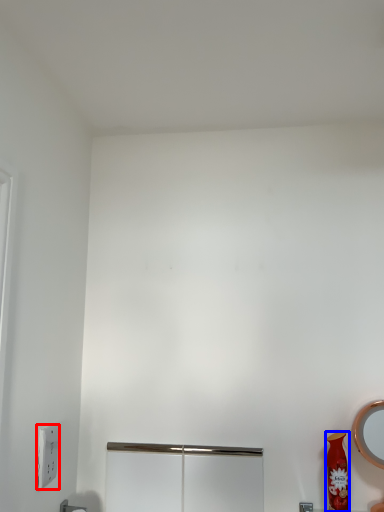
Question: Which point is closer to the camera, light switch (highlighted by a red box) or vase (highlighted by a blue box)?

Choices:
 (A) light switch
 (B) vase

Answer: (A)